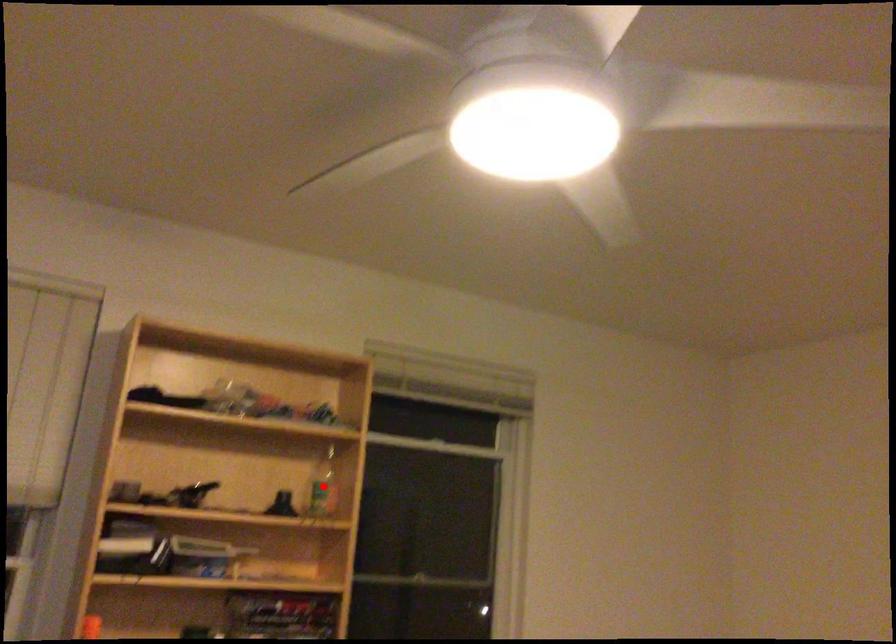
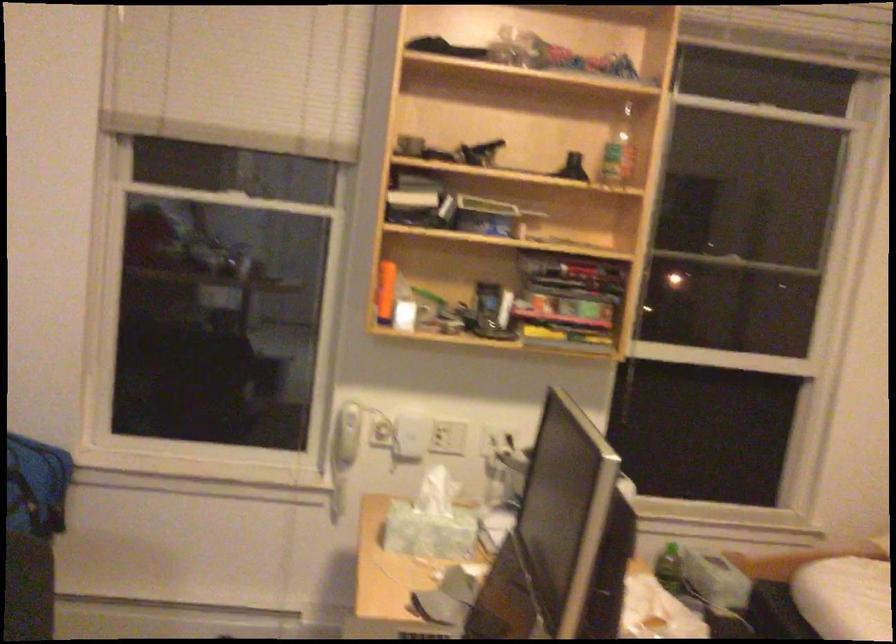
In the second image, find the point that corresponds to the highlighted location in the first image.

(617, 151)